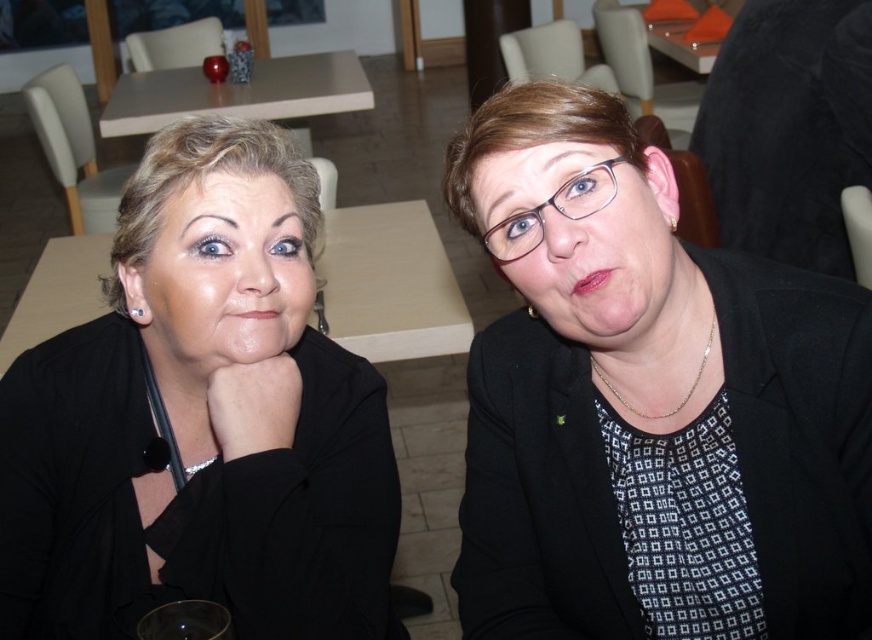
Question: Which of the following is the farthest from the observer?

Choices:
 (A) (254, 93)
 (B) (614, 314)

Answer: (A)

Question: Does matte black jacket at left come behind wooden table at center?

Choices:
 (A) yes
 (B) no

Answer: (B)

Question: Which is nearer to the wooden table at center?

Choices:
 (A) matte black jacket at left
 (B) matte black face at center
 (C) matte black blazer at center

Answer: (A)

Question: Does wooden table at center appear under matte wood table at upper center?

Choices:
 (A) yes
 (B) no

Answer: (A)

Question: Which of the following is the farthest from the observer?

Choices:
 (A) wooden table at center
 (B) matte black blazer at center

Answer: (A)

Question: Does matte black blazer at center appear on the right side of matte black glasses at center?

Choices:
 (A) no
 (B) yes

Answer: (B)